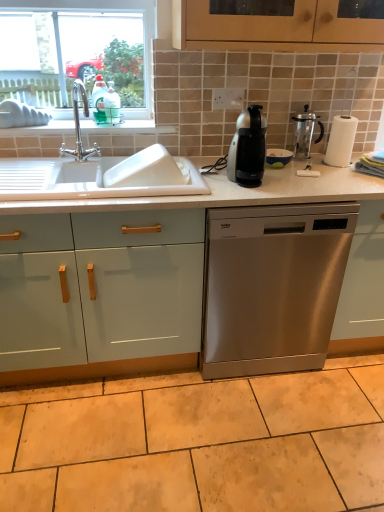
Question: Is beige ceramic tile at lower center bigger or smaller than stainless steel dishwasher at center?

Choices:
 (A) small
 (B) big

Answer: (A)

Question: In terms of height, does beige ceramic tile at lower center look taller or shorter compared to stainless steel dishwasher at center?

Choices:
 (A) short
 (B) tall

Answer: (A)

Question: Which of these objects is positioned closest to the mint glossy cabinet doors at lower left?

Choices:
 (A) translucent plastic bottle at upper left
 (B) clear glass window at upper left
 (C) stainless steel dishwasher at center
 (D) metallic glass carafe at upper right
 (E) satin black coffee machine at center

Answer: (C)

Question: Which object is the farthest from the polished chrome faucet at upper left?

Choices:
 (A) mint glossy cabinet doors at lower left
 (B) translucent plastic bottle at upper left
 (C) beige ceramic tile at lower center
 (D) metallic glass carafe at upper right
 (E) satin black coffee machine at center

Answer: (C)